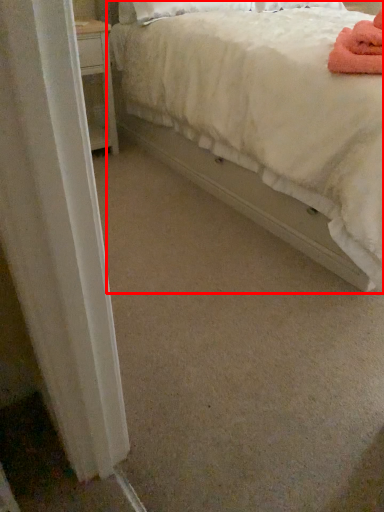
Question: From the image's perspective, where is bed (annotated by the red box) located relative to bath towel?

Choices:
 (A) below
 (B) above

Answer: (B)